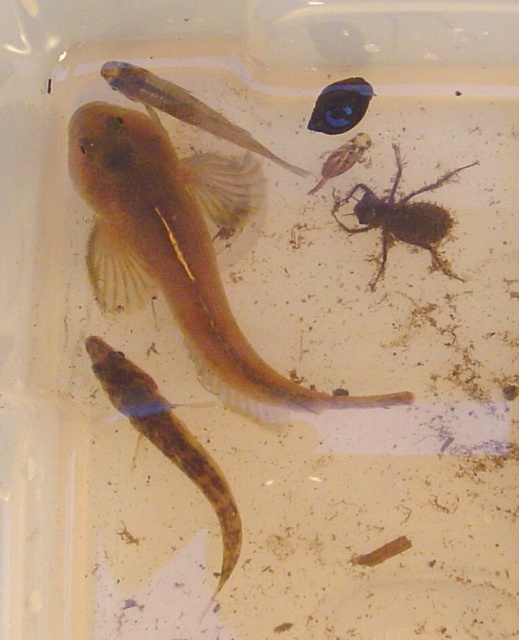
Question: Which object appears closest to the camera in this image?

Choices:
 (A) translucent gelatinous fish at bottom left
 (B) translucent gelatinous fish at upper center
 (C) glossy black fish at upper center
 (D) brown fuzzy insect at upper right

Answer: (A)

Question: Does glossy black fish at upper center appear on the right side of translucent brown insect at upper center?

Choices:
 (A) yes
 (B) no

Answer: (A)

Question: Can you confirm if translucent gelatinous fish at bottom left is smaller than brown fuzzy insect at upper right?

Choices:
 (A) no
 (B) yes

Answer: (A)

Question: Does brown fuzzy insect at upper right have a smaller size compared to translucent brown insect at upper center?

Choices:
 (A) yes
 (B) no

Answer: (B)

Question: Among these objects, which one is farthest from the camera?

Choices:
 (A) glossy black fish at upper center
 (B) brown fuzzy insect at upper right
 (C) translucent gelatinous fish at upper center
 (D) translucent gelatinous fish at center

Answer: (B)

Question: Which point is farther from the camera taking this photo?

Choices:
 (A) (126, 80)
 (B) (291, 397)
 (C) (337, 170)
 (D) (170, 403)

Answer: (C)